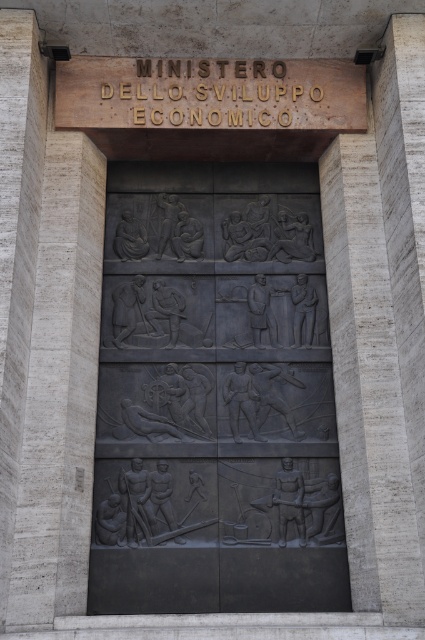
Question: Which object is the closest to the gold metallic sign at upper center?

Choices:
 (A) black stone relief at center
 (B) gray stone pillar at right

Answer: (A)

Question: From the image, what is the correct spatial relationship of gray stone pillar at right in relation to gold metallic sign at upper center?

Choices:
 (A) above
 (B) below

Answer: (B)

Question: Among these points, which one is nearest to the camera?

Choices:
 (A) (308, 84)
 (B) (101, 445)

Answer: (B)

Question: Does gray stone pillar at right appear on the right side of gold metallic sign at upper center?

Choices:
 (A) no
 (B) yes

Answer: (B)

Question: Can you confirm if gray stone pillar at right is positioned to the right of gold metallic sign at upper center?

Choices:
 (A) yes
 (B) no

Answer: (A)

Question: Among these points, which one is farthest from the camera?

Choices:
 (A) (388, 141)
 (B) (268, 99)
 (C) (285, 262)

Answer: (C)